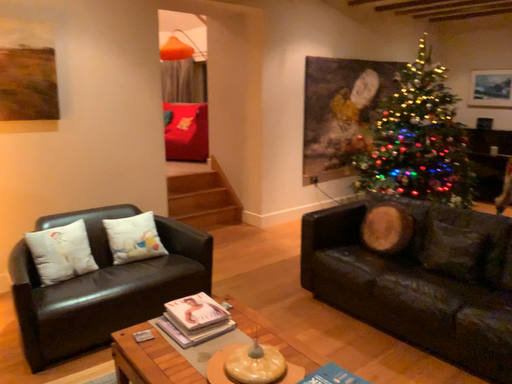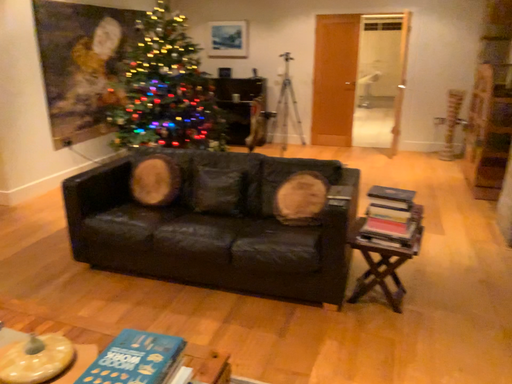
Question: How did the camera likely rotate when shooting the video?

Choices:
 (A) rotated right
 (B) rotated left

Answer: (A)